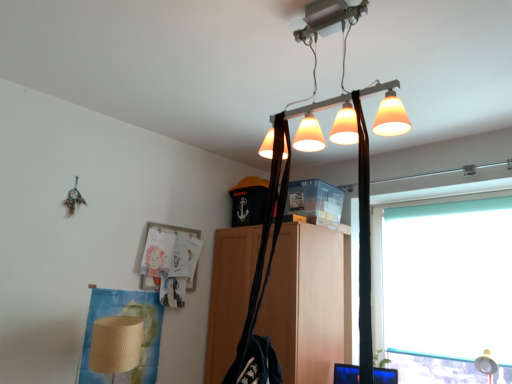
Question: Are matte wood cabinet at center and black fabric shoulder bag at center beside each other?

Choices:
 (A) no
 (B) yes

Answer: (A)

Question: Can you confirm if matte wood cabinet at center is smaller than black fabric shoulder bag at center?

Choices:
 (A) no
 (B) yes

Answer: (A)

Question: Can you confirm if matte wood cabinet at center is taller than black fabric shoulder bag at center?

Choices:
 (A) yes
 (B) no

Answer: (A)

Question: From a real-world perspective, does matte wood cabinet at center stand above black fabric shoulder bag at center?

Choices:
 (A) yes
 (B) no

Answer: (B)

Question: Is matte wood cabinet at center thinner than black fabric shoulder bag at center?

Choices:
 (A) no
 (B) yes

Answer: (A)

Question: Visually, is matte orange lampshade at upper center positioned to the left or to the right of metallic gold table lamp at lower right?

Choices:
 (A) right
 (B) left

Answer: (B)

Question: From the image's perspective, is matte orange lampshade at upper center located above or below metallic gold table lamp at lower right?

Choices:
 (A) above
 (B) below

Answer: (A)

Question: Considering their positions, is matte orange lampshade at upper center located in front of or behind metallic gold table lamp at lower right?

Choices:
 (A) behind
 (B) front

Answer: (B)

Question: From a real-world perspective, is matte orange lampshade at upper center above or below metallic gold table lamp at lower right?

Choices:
 (A) below
 (B) above

Answer: (B)

Question: Visually, is metallic gold table lamp at lower right positioned to the left or to the right of teal matte window at right?

Choices:
 (A) right
 (B) left

Answer: (A)

Question: Based on their sizes in the image, would you say metallic gold table lamp at lower right is bigger or smaller than teal matte window at right?

Choices:
 (A) small
 (B) big

Answer: (A)

Question: Is metallic gold table lamp at lower right taller or shorter than teal matte window at right?

Choices:
 (A) short
 (B) tall

Answer: (A)

Question: Would you say metallic gold table lamp at lower right is inside or outside teal matte window at right?

Choices:
 (A) outside
 (B) inside

Answer: (A)

Question: Considering the positions of teal matte window at right and matte orange lampshade at upper center in the image, is teal matte window at right taller or shorter than matte orange lampshade at upper center?

Choices:
 (A) short
 (B) tall

Answer: (B)

Question: From the image's perspective, is teal matte window at right above or below matte orange lampshade at upper center?

Choices:
 (A) above
 (B) below

Answer: (B)